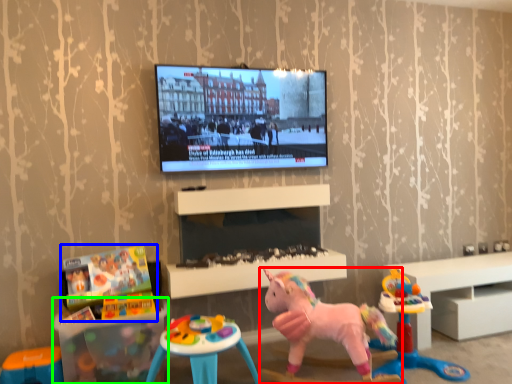
Question: Which object is positioned closest to toy (highlighted by a red box)? Select from toy (highlighted by a blue box) and table (highlighted by a green box).

Choices:
 (A) toy
 (B) table

Answer: (B)